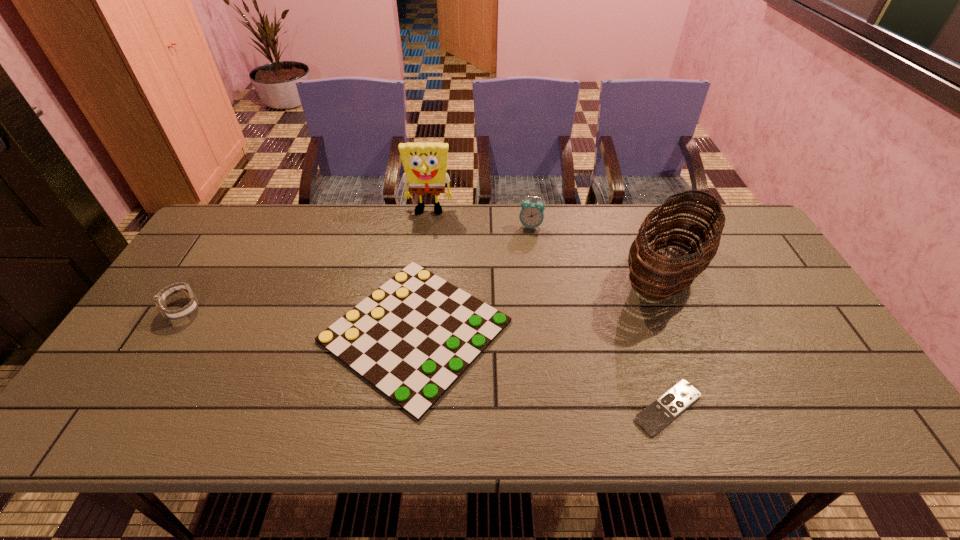
Identify the location of sponge. (425, 164).

You are a GUI agent. You are given a task and a screenshot of the screen. Output one action in this format:
    pyautogui.click(x=<x>, y=<y>)
    Task: Click on the tallest object
    
    Given the screenshot: What is the action you would take?
    pyautogui.click(x=425, y=164)

The height and width of the screenshot is (540, 960). I want to click on basket, so click(x=658, y=276).

Find the location of `the second farthest object`. the second farthest object is located at coordinates (531, 215).

You are a GUI agent. You are given a task and a screenshot of the screen. Output one action in this format:
    pyautogui.click(x=<x>, y=<y>)
    Task: Click on the fourth shortest object
    The height and width of the screenshot is (540, 960).
    Given the screenshot: What is the action you would take?
    pyautogui.click(x=531, y=215)

Locate an element on the screen. This screenshot has height=540, width=960. watch is located at coordinates (160, 299).

Where is `the third shortest object`? The width and height of the screenshot is (960, 540). the third shortest object is located at coordinates (160, 299).

In order to click on the fifth tallest object in this screenshot , I will do `click(412, 338)`.

Locate an element on the screen. The width and height of the screenshot is (960, 540). remote control is located at coordinates (662, 411).

Locate an element on the screen. The image size is (960, 540). vacant region located 0.400m on the face of the farthest object is located at coordinates (416, 309).